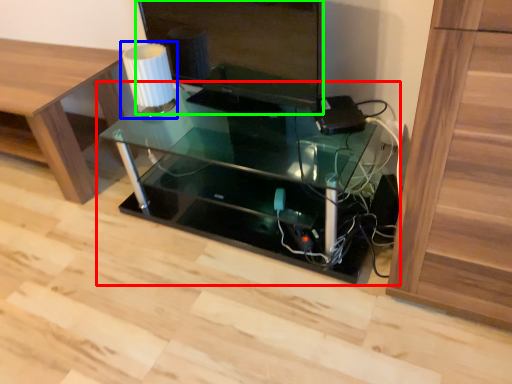
Question: Which is farther away from table (highlighted by a red box)? table lamp (highlighted by a blue box) or computer monitor (highlighted by a green box)?

Choices:
 (A) table lamp
 (B) computer monitor

Answer: (A)